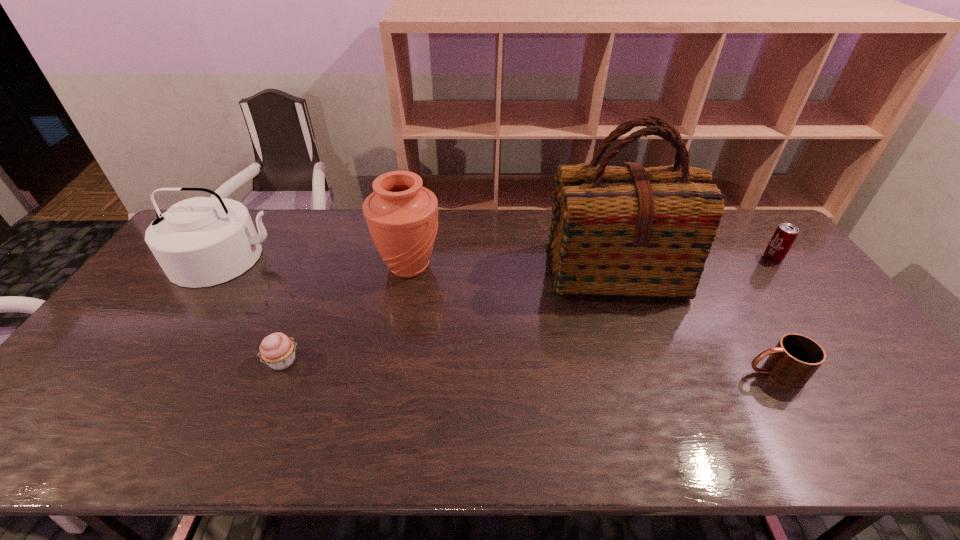
This screenshot has height=540, width=960. I want to click on free spot between the cupcake and the third shortest object, so click(528, 309).

Identify the location of free space that is in between the tallest object and the fourth object from right to left. The image size is (960, 540). (511, 269).

I want to click on free space between the shopping bag and the third object from left to right, so click(x=511, y=269).

You are a GUI agent. You are given a task and a screenshot of the screen. Output one action in this format:
    pyautogui.click(x=<x>, y=<y>)
    Task: Click on the empty location between the cupcake and the third shortest object
    
    Given the screenshot: What is the action you would take?
    pyautogui.click(x=528, y=309)

The height and width of the screenshot is (540, 960). I want to click on free space between the second object from right to left and the fourth shortest object, so click(x=501, y=315).

Select which object appears as the closest to the mug. Please provide its 2D coordinates. Your answer should be formatted as a tuple, i.e. [(x, y)], where the tuple contains the x and y coordinates of a point satisfying the conditions above.

[(626, 231)]

In order to click on object that is the closest to the cupcake in this screenshot , I will do `click(199, 242)`.

Locate an element on the screen. vacant space that satisfies the following two spatial constraints: 1. on the spout of the leftmost object; 2. on the left side of the third object from left to right is located at coordinates (222, 266).

Image resolution: width=960 pixels, height=540 pixels. Find the location of `free space that satisfies the following two spatial constraints: 1. on the spout of the fourth object from right to left; 2. on the left side of the kettle`. free space that satisfies the following two spatial constraints: 1. on the spout of the fourth object from right to left; 2. on the left side of the kettle is located at coordinates (222, 266).